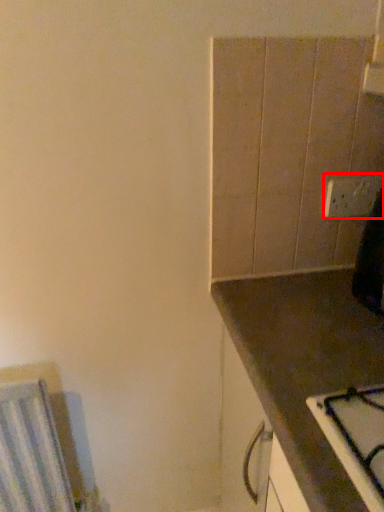
Question: From the image, what is the correct spatial relationship of electric outlet (annotated by the red box) in relation to countertop?

Choices:
 (A) right
 (B) left

Answer: (A)